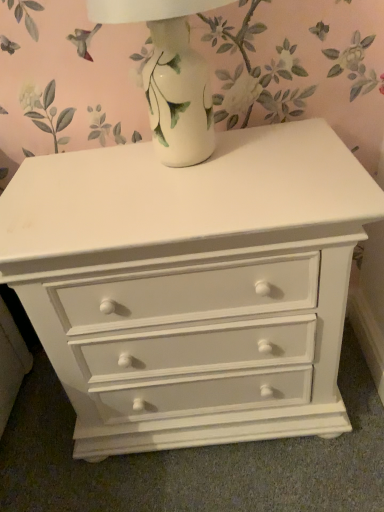
What is the approximate height of white glossy vase at upper center?

11.66 inches.

The image size is (384, 512). What do you see at coordinates (171, 76) in the screenshot?
I see `white glossy vase at upper center` at bounding box center [171, 76].

Measure the distance between point (162, 144) and camera.

Point (162, 144) and camera are 30.79 inches apart from each other.

At what (x,y) coordinates should I click in order to perform the action: click on white glossy vase at upper center. Please return your answer as a coordinate pair (x, y). Looking at the image, I should click on (171, 76).

In order to face white glossy vase at upper center, should I rotate leftwards or rightwards?

Turn left approximately 3.035 degrees to face it.

What do you see at coordinates (192, 285) in the screenshot? The width and height of the screenshot is (384, 512). I see `white painted wood chest of drawers at center` at bounding box center [192, 285].

Measure the distance between white painted wood chest of drawers at center and camera.

The depth of white painted wood chest of drawers at center is 24.15 inches.

At what (x,y) coordinates should I click in order to perform the action: click on white painted wood chest of drawers at center. Please return your answer as a coordinate pair (x, y). This screenshot has height=512, width=384. Looking at the image, I should click on (192, 285).

Identify the location of white glossy vase at upper center. The image size is (384, 512). (171, 76).

In the image, is white painted wood chest of drawers at center on the left side or the right side of white glossy vase at upper center?

white painted wood chest of drawers at center is positioned on white glossy vase at upper center's right side.

Consider the image. Which object is further away from the camera, white painted wood chest of drawers at center or white glossy vase at upper center?

white painted wood chest of drawers at center is more distant.

Which is behind, point (176, 254) or point (183, 108)?

The point (183, 108) is more distant.

From the image's perspective, is white painted wood chest of drawers at center under white glossy vase at upper center?

Yes, from the image's perspective, white painted wood chest of drawers at center is below white glossy vase at upper center.

From a real-world perspective, which object stands above the other?

From a 3D spatial view, white glossy vase at upper center is above.

Which object is wider, white painted wood chest of drawers at center or white glossy vase at upper center?

With larger width is white painted wood chest of drawers at center.

Can you confirm if white painted wood chest of drawers at center is taller than white glossy vase at upper center?

Yes.

Is white painted wood chest of drawers at center bigger than white glossy vase at upper center?

Indeed, white painted wood chest of drawers at center has a larger size compared to white glossy vase at upper center.

In the scene shown: Is white painted wood chest of drawers at center completely or partially outside of white glossy vase at upper center?

Absolutely, white painted wood chest of drawers at center is external to white glossy vase at upper center.

Is white painted wood chest of drawers at center placed right next to white glossy vase at upper center?

No, white painted wood chest of drawers at center is not with white glossy vase at upper center.

Based on the photo, is white painted wood chest of drawers at center looking in the opposite direction of white glossy vase at upper center?

white painted wood chest of drawers at center is not turned away from white glossy vase at upper center.

Measure the distance between white painted wood chest of drawers at center and white glossy vase at upper center.

white painted wood chest of drawers at center is 11.06 inches away from white glossy vase at upper center.

Identify the location of chest of drawers below the white glossy vase at upper center (from the image's perspective). (192, 285).

Which is more to the left, white glossy vase at upper center or white painted wood chest of drawers at center?

white glossy vase at upper center is more to the left.

Considering the positions of objects white glossy vase at upper center and white painted wood chest of drawers at center in the image provided, who is behind, white glossy vase at upper center or white painted wood chest of drawers at center?

white painted wood chest of drawers at center is more distant.

Considering the positions of point (167, 102) and point (69, 160), is point (167, 102) closer or farther from the camera than point (69, 160)?

Point (167, 102) is closer to the camera than point (69, 160).

From the image's perspective, is white glossy vase at upper center under white painted wood chest of drawers at center?

No, from the image's perspective, white glossy vase at upper center is not below white painted wood chest of drawers at center.

From a real-world perspective, is white glossy vase at upper center under white painted wood chest of drawers at center?

Incorrect, from a real-world perspective, white glossy vase at upper center is higher than white painted wood chest of drawers at center.

Is white glossy vase at upper center wider or thinner than white painted wood chest of drawers at center?

Considering their sizes, white glossy vase at upper center looks slimmer than white painted wood chest of drawers at center.

Does white glossy vase at upper center have a lesser height compared to white painted wood chest of drawers at center?

Yes.

Which of these two, white glossy vase at upper center or white painted wood chest of drawers at center, is smaller?

white glossy vase at upper center.

Is white glossy vase at upper center outside of white painted wood chest of drawers at center?

white glossy vase at upper center is positioned outside white painted wood chest of drawers at center.

Consider the image. Is white glossy vase at upper center not near white painted wood chest of drawers at center?

No, there isn't a large distance between white glossy vase at upper center and white painted wood chest of drawers at center.

Does white glossy vase at upper center turn towards white painted wood chest of drawers at center?

No, white glossy vase at upper center is not aimed at white painted wood chest of drawers at center.

Can you tell me how much white glossy vase at upper center and white painted wood chest of drawers at center differ in facing direction?

0.163 degrees.

Looking at this image, measure the distance between white glossy vase at upper center and white painted wood chest of drawers at center.

11.06 inches.

At what (x,y) coordinates should I click in order to perform the action: click on table lamp in front of the white painted wood chest of drawers at center. Please return your answer as a coordinate pair (x, y). The width and height of the screenshot is (384, 512). Looking at the image, I should click on (171, 76).

Identify the location of the chest of drawers lying behind the white glossy vase at upper center. (192, 285).

Where is `chest of drawers that appears on the right of white glossy vase at upper center`? The height and width of the screenshot is (512, 384). chest of drawers that appears on the right of white glossy vase at upper center is located at coordinates (192, 285).